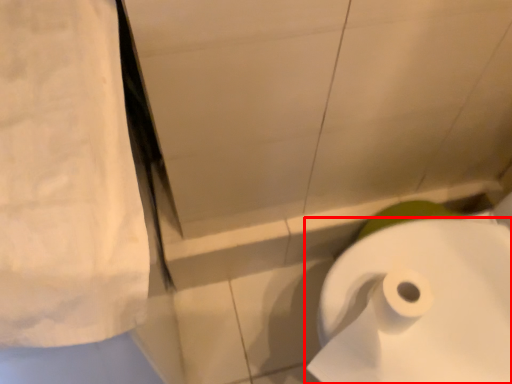
Question: From the image's perspective, what is the correct spatial relationship of toilet paper (annotated by the red box) in relation to linen?

Choices:
 (A) below
 (B) above

Answer: (A)